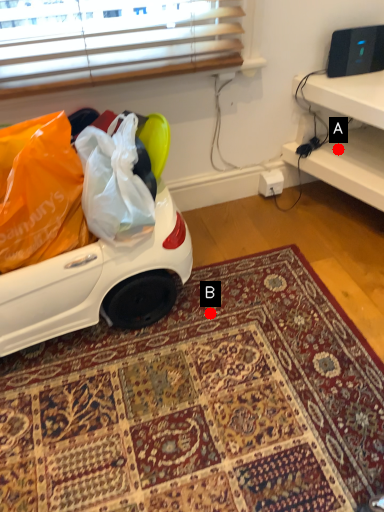
Question: Two points are circled on the image, labeled by A and B beside each circle. Which point appears closest to the camera in this image?

Choices:
 (A) A is closer
 (B) B is closer

Answer: (B)